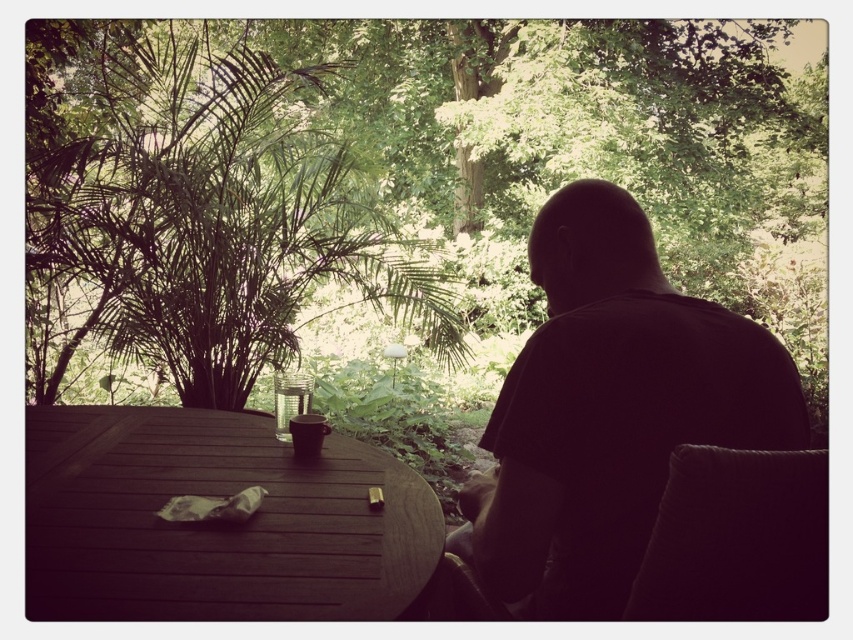
Between black matte shirt at center and clear glass cup at center, which one appears on the right side from the viewer's perspective?

black matte shirt at center is more to the right.

Can you confirm if black matte shirt at center is positioned below clear glass cup at center?

Actually, black matte shirt at center is above clear glass cup at center.

I want to click on black matte shirt at center, so click(x=608, y=410).

Which of these two, green leafy tree at upper center or black matte shirt at center, stands shorter?

Standing shorter between the two is green leafy tree at upper center.

Is the position of green leafy tree at upper center more distant than that of black matte shirt at center?

Yes, green leafy tree at upper center is behind black matte shirt at center.

Locate an element on the screen. green leafy tree at upper center is located at coordinates (378, 179).

Which is more to the left, wooden table at center or clear glass cup at center?

wooden table at center is more to the left.

This screenshot has height=640, width=853. What do you see at coordinates (215, 524) in the screenshot?
I see `wooden table at center` at bounding box center [215, 524].

You are a GUI agent. You are given a task and a screenshot of the screen. Output one action in this format:
    pyautogui.click(x=<x>, y=<y>)
    Task: Click on the wooden table at center
    This screenshot has width=853, height=640.
    Given the screenshot: What is the action you would take?
    pyautogui.click(x=215, y=524)